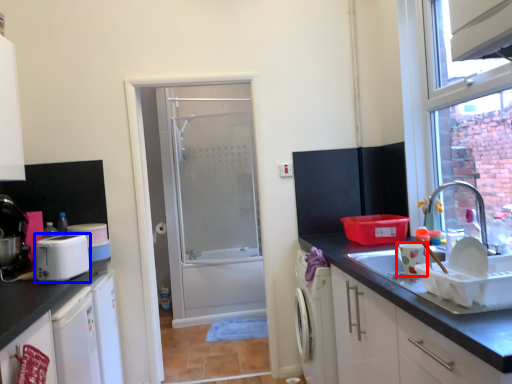
Question: Which of the following is the closest to the observer, appliance (highlighted by a red box) or appliance (highlighted by a blue box)?

Choices:
 (A) appliance
 (B) appliance

Answer: (A)